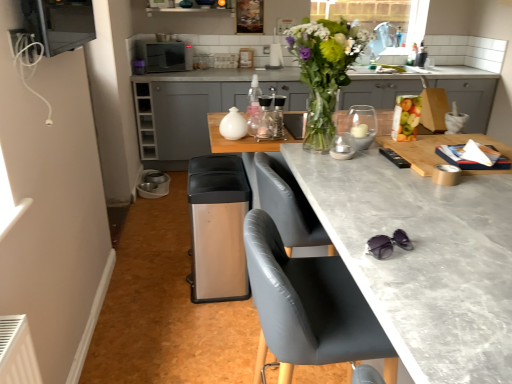
Describe the element at coordinates (233, 125) in the screenshot. I see `white glossy jar at center, which appears as the second appliance when viewed from the right` at that location.

Image resolution: width=512 pixels, height=384 pixels. What do you see at coordinates (253, 106) in the screenshot?
I see `clear glass spray bottle at center` at bounding box center [253, 106].

Describe the element at coordinates (406, 118) in the screenshot. I see `translucent plastic bag of assorted fruits at right` at that location.

At what (x,y) coordinates should I click in order to perform the action: click on satin black microwave at upper center. Please return your answer as a coordinate pair (x, y). This screenshot has height=384, width=512. Looking at the image, I should click on (161, 56).

The width and height of the screenshot is (512, 384). I want to click on translucent glass vase at upper center, so click(x=324, y=71).

Describe the element at coordinates (324, 71) in the screenshot. I see `translucent glass vase at upper center` at that location.

The image size is (512, 384). I want to click on translucent glass candle holder at center, marked as the 2th appliance in a bottom-to-top arrangement, so click(343, 146).

Identify the location of metallic silver microwave at upper left, acting as the 4th appliance starting from the back. Image resolution: width=512 pixels, height=384 pixels. (59, 23).

Which of these two, translucent plastic bag of assorted fruits at right or white glossy jar at center, which is the 3th appliance in bottom-to-top order, is smaller?

translucent plastic bag of assorted fruits at right is smaller.

Considering the relative sizes of translucent plastic bag of assorted fruits at right and white glossy jar at center, positioned as the third appliance in front-to-back order, in the image provided, is translucent plastic bag of assorted fruits at right shorter than white glossy jar at center, positioned as the third appliance in front-to-back order,?

No.

Considering the positions of objects translucent plastic bag of assorted fruits at right and white glossy jar at center, positioned as the third appliance in front-to-back order, in the image provided, who is behind, translucent plastic bag of assorted fruits at right or white glossy jar at center, positioned as the third appliance in front-to-back order,?

Positioned behind is white glossy jar at center, positioned as the third appliance in front-to-back order.

Would you say clear glass spray bottle at center is outside translucent glass candle holder at center, which ranks as the 2th appliance in front-to-back order?

clear glass spray bottle at center is positioned outside translucent glass candle holder at center, which ranks as the 2th appliance in front-to-back order.

Is clear glass spray bottle at center in contact with translucent glass candle holder at center, the 3th appliance from the top?

No, clear glass spray bottle at center is not in contact with translucent glass candle holder at center, the 3th appliance from the top.

From the image's perspective, who appears lower, clear glass spray bottle at center or translucent glass candle holder at center, positioned as the 3th appliance in back-to-front order?

translucent glass candle holder at center, positioned as the 3th appliance in back-to-front order, is shown below in the image.

Based on the photo, how much distance is there between clear glass spray bottle at center and translucent glass candle holder at center, positioned as the 3th appliance in back-to-front order?

The distance of clear glass spray bottle at center from translucent glass candle holder at center, positioned as the 3th appliance in back-to-front order, is 17.46 inches.

Does point (324, 70) come closer to viewer compared to point (486, 76)?

Yes, point (324, 70) is in front of point (486, 76).

From a real-world perspective, which object stands above the other?

From a 3D spatial view, translucent glass vase at upper center is above.

Is translucent glass vase at upper center directly adjacent to matte gray cabinets at center?

No.

From the image's perspective, which one is positioned higher, translucent glass vase at upper center or matte gray cabinets at center?

matte gray cabinets at center appears higher in the image.

Is metallic silver microwave at upper left, placed as the 1th appliance when sorted from front to back, touching translucent plastic bag of assorted fruits at right?

No, metallic silver microwave at upper left, placed as the 1th appliance when sorted from front to back, is not next to translucent plastic bag of assorted fruits at right.

Can you confirm if metallic silver microwave at upper left, placed as the 1th appliance when sorted from front to back, is smaller than translucent plastic bag of assorted fruits at right?

Actually, metallic silver microwave at upper left, placed as the 1th appliance when sorted from front to back, might be larger than translucent plastic bag of assorted fruits at right.

Based on the photo, considering the sizes of objects metallic silver microwave at upper left, acting as the 4th appliance starting from the back, and translucent plastic bag of assorted fruits at right in the image provided, who is taller, metallic silver microwave at upper left, acting as the 4th appliance starting from the back, or translucent plastic bag of assorted fruits at right?

Standing taller between the two is metallic silver microwave at upper left, acting as the 4th appliance starting from the back.

What are the coordinates of `food below the metallic silver microwave at upper left, the 1th appliance positioned from the top (from the image's perspective)` in the screenshot? It's located at (406, 118).

Considering the relative sizes of metallic silver microwave at upper left, the fourth appliance from the bottom, and translucent glass vase at upper center in the image provided, is metallic silver microwave at upper left, the fourth appliance from the bottom, shorter than translucent glass vase at upper center?

Yes.

In the image, is metallic silver microwave at upper left, the 1th appliance positioned from the top, positioned in front of or behind translucent glass vase at upper center?

metallic silver microwave at upper left, the 1th appliance positioned from the top, is positioned closer to the viewer than translucent glass vase at upper center.

Considering the positions of points (51, 53) and (332, 128), is point (51, 53) closer to camera compared to point (332, 128)?

Yes.

Is point (354, 271) in front of point (404, 96)?

Yes, it is in front of point (404, 96).

Is matte gray countertop at center wider or thinner than translucent plastic bag of assorted fruits at right?

Clearly, matte gray countertop at center has more width compared to translucent plastic bag of assorted fruits at right.

Is matte gray countertop at center beside translucent plastic bag of assorted fruits at right?

No, matte gray countertop at center is not touching translucent plastic bag of assorted fruits at right.

Is translucent plastic bag of assorted fruits at right at the back of matte gray countertop at center?

No, matte gray countertop at center's orientation is not away from translucent plastic bag of assorted fruits at right.

Is clear glass spray bottle at center not within matte gray cabinets at center?

Yes, clear glass spray bottle at center is located beyond the bounds of matte gray cabinets at center.

Considering the relative positions of clear glass spray bottle at center and matte gray cabinets at center in the image provided, is clear glass spray bottle at center to the left of matte gray cabinets at center from the viewer's perspective?

Yes, clear glass spray bottle at center is to the left of matte gray cabinets at center.

Is clear glass spray bottle at center wider than matte gray cabinets at center?

No.

You are a GUI agent. You are given a task and a screenshot of the screen. Output one action in this format:
    pyautogui.click(x=<x>, y=<y>)
    Task: Click on the 1st appliance positioned below the translucent plastic bag of assorted fruits at right (from the image's perspective)
    The width and height of the screenshot is (512, 384).
    Given the screenshot: What is the action you would take?
    pyautogui.click(x=233, y=125)

In order to click on bottle lying on the left of translucent glass candle holder at center, the first appliance in the right-to-left sequence in this screenshot , I will do `click(253, 106)`.

When comparing their distances from matte gray countertop at center, does clear glass spray bottle at center or translucent glass candle holder at center, the 3th appliance from the top, seem further?

clear glass spray bottle at center is further to matte gray countertop at center.

Looking at the image, which one is located closer to translucent plastic bag of assorted fruits at right, satin black microwave at upper center or white glossy jar at center, which appears as the second appliance when viewed from the right?

Based on the image, white glossy jar at center, which appears as the second appliance when viewed from the right, appears to be nearer to translucent plastic bag of assorted fruits at right.

From the picture: When comparing their distances from clear glass spray bottle at center, does satin black microwave at upper center or translucent glass candle holder at center, marked as the 2th appliance in a bottom-to-top arrangement, seem closer?

translucent glass candle holder at center, marked as the 2th appliance in a bottom-to-top arrangement, is closer to clear glass spray bottle at center.

Considering their positions, is matte gray countertop at center positioned further to clear glass spray bottle at center than translucent glass vase at upper center?

matte gray countertop at center is positioned further to the anchor clear glass spray bottle at center.

When comparing their distances from matte gray countertop at center, does matte gray cabinets at center or metallic silver microwave at upper left, placed as the 1th appliance when sorted from front to back, seem closer?

Based on the image, metallic silver microwave at upper left, placed as the 1th appliance when sorted from front to back, appears to be nearer to matte gray countertop at center.

Based on their spatial positions, is satin black microwave at upper center or white glossy jar at center, positioned as the third appliance in front-to-back order, closer to translucent glass candle holder at center, positioned as the 4th appliance in left-to-right order?

white glossy jar at center, positioned as the third appliance in front-to-back order, is positioned closer to the anchor translucent glass candle holder at center, positioned as the 4th appliance in left-to-right order.

Consider the image. When comparing their distances from matte gray countertop at center, does stainless steel trash can at lower center, which is the 2th appliance in left-to-right order, or satin black microwave at upper center seem further?

Among the two, satin black microwave at upper center is located further to matte gray countertop at center.

Which object lies nearer to the anchor point white glossy jar at center, the 3th appliance in the left-to-right sequence, stainless steel trash can at lower center, the 1th appliance when ordered from bottom to top, or translucent glass candle holder at center, the 3th appliance from the top?

stainless steel trash can at lower center, the 1th appliance when ordered from bottom to top, lies closer to white glossy jar at center, the 3th appliance in the left-to-right sequence, than the other object.

Locate an element on the screen. This screenshot has height=384, width=512. food between translucent glass vase at upper center and matte gray cabinets at center in the front-back direction is located at coordinates (406, 118).

I want to click on bottle located between white glossy jar at center, positioned as the third appliance in front-to-back order, and translucent plastic bag of assorted fruits at right in the left-right direction, so click(x=253, y=106).

Locate an element on the screen. This screenshot has height=384, width=512. bottle positioned between white glossy jar at center, which appears as the second appliance when viewed from the right, and satin black microwave at upper center from near to far is located at coordinates (253, 106).

At what (x,y) coordinates should I click in order to perform the action: click on cabinetry positioned between clear glass spray bottle at center and satin black microwave at upper center from near to far. Please return your answer as a coordinate pair (x, y). The width and height of the screenshot is (512, 384). Looking at the image, I should click on (198, 106).